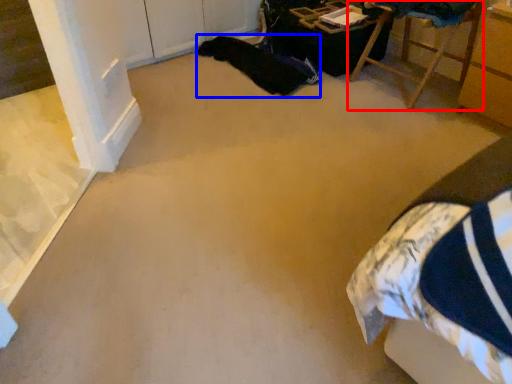
Question: Which of the following is the closest to the observer, furniture (highlighted by a red box) or blanket (highlighted by a blue box)?

Choices:
 (A) furniture
 (B) blanket

Answer: (A)